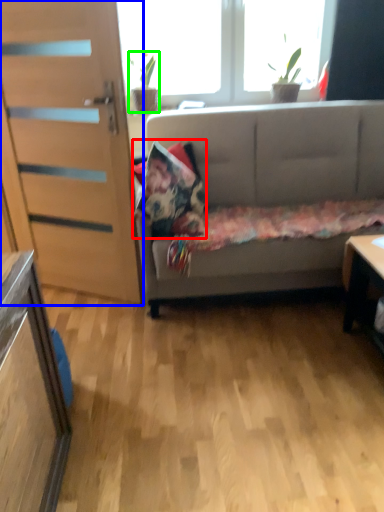
Question: Which object is positioned closest to pillow (highlighted by a red box)? Select from door (highlighted by a blue box) and houseplant (highlighted by a green box).

Choices:
 (A) door
 (B) houseplant

Answer: (A)